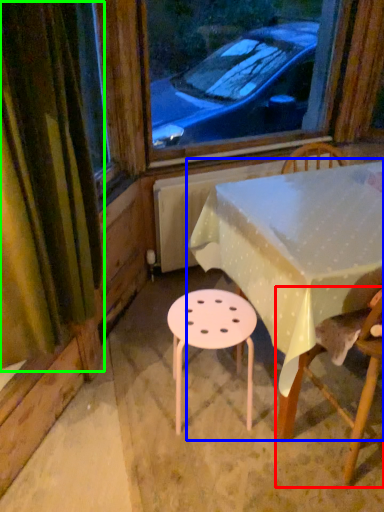
Question: Which object is positioned farthest from chair (highlighted by a red box)? Select from table (highlighted by a blue box) and curtain (highlighted by a green box).

Choices:
 (A) table
 (B) curtain

Answer: (B)